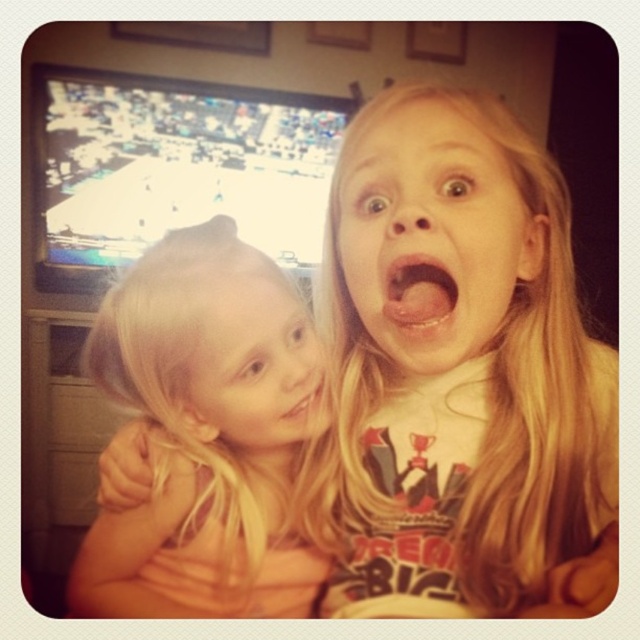
You are a photographer trying to capture a closeup of both the smooth blonde hair at center and the pink glossy lips at center. Since you want to ensure both are in focus, which object should you adjust your camera focus on first, the larger one or the smaller one?

The smooth blonde hair at center is larger in size than pink glossy lips at center, so you should focus on the larger object first to ensure both are in focus.

You are a makeup artist trying to apply lipstick to two models whose lips are positioned similarly to the image. The models are sitting on a bench that is 1 meter apart from each other. If the distance between the pink glossy lips at center and pink matte lips at center in the image is 13.22 centimeters, would you need to adjust your tools to reach both models comfortably?

The distance between the pink glossy lips at center and pink matte lips at center is 13.22 centimeters. Since the models are 1 meter apart, which is significantly larger than the 13.22 cm distance between the lips, the makeup artist would need to move closer to each model individually to apply the lipstick comfortably.

You are a makeup artist observing two lip samples in the image. The scene shows two children in a cozy indoor setting with a TV showing a sports game. You need to choose the larger one between the pink glossy lips at center and the pink matte lips at center. Which one is bigger?

The pink glossy lips at center is bigger than the pink matte lips at center according to the description.